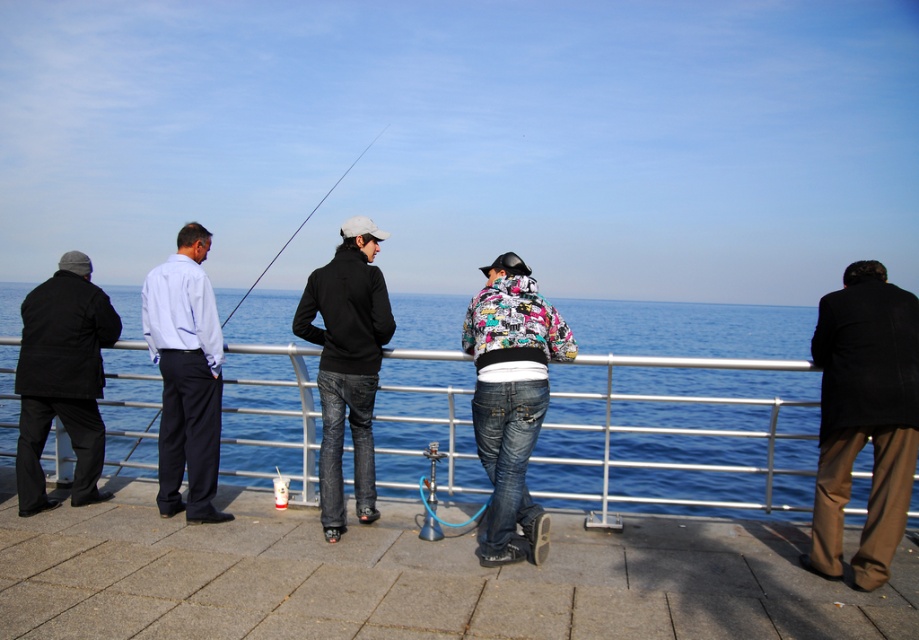
You are standing on the paved area near the railing overlooking the sea. You see a black matte jacket at center and a black plastic fishing pole at left. Which object is positioned more to the left?

The black plastic fishing pole at left is more to the left than the black matte jacket at center.